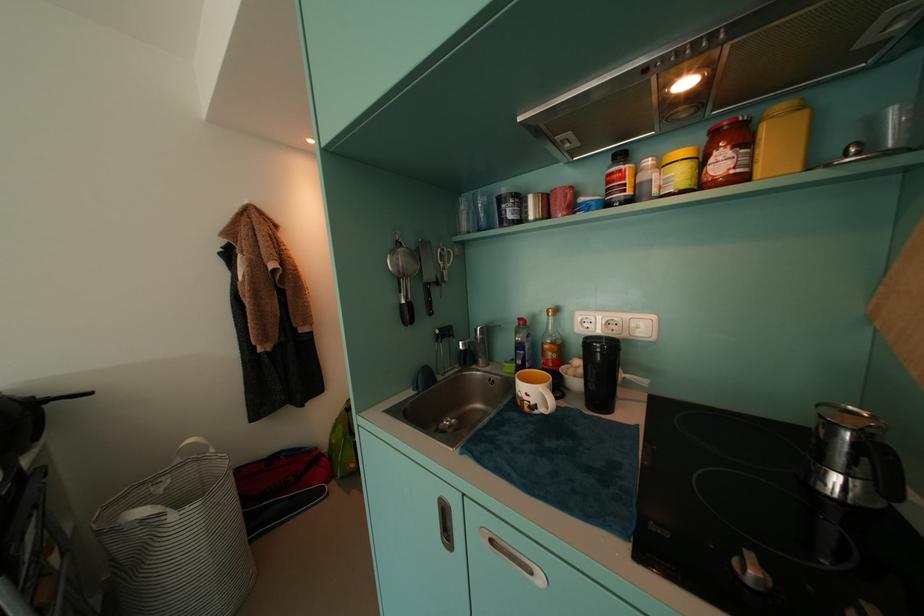
Where is `silver faucet handle`? The height and width of the screenshot is (616, 924). silver faucet handle is located at coordinates click(475, 347).